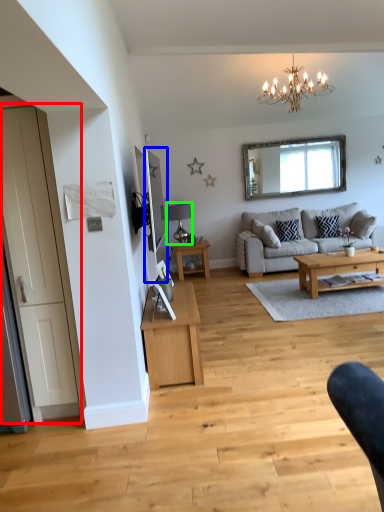
Question: Which object is positioned farthest from door (highlighted by a red box)? Select from mirror (highlighted by a blue box) and lamp (highlighted by a green box).

Choices:
 (A) mirror
 (B) lamp

Answer: (B)